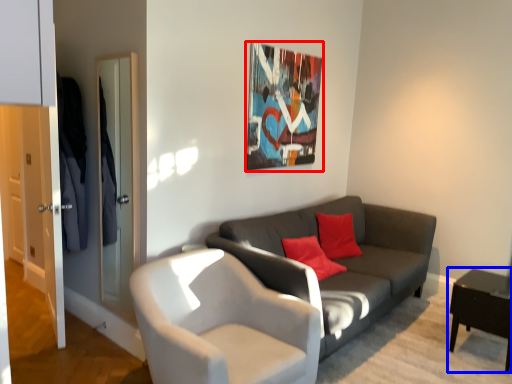
Question: Among these objects, which one is farthest to the camera, picture frame (highlighted by a red box) or table (highlighted by a blue box)?

Choices:
 (A) picture frame
 (B) table

Answer: (A)